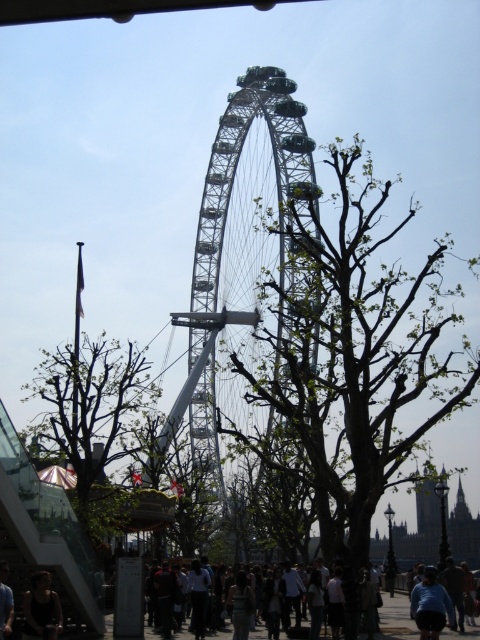
Between green metallic ferris wheel at center and dark brown hair at lower left, which one is positioned higher?

green metallic ferris wheel at center is higher up.

The image size is (480, 640). I want to click on green metallic ferris wheel at center, so click(251, 193).

You are a GUI agent. You are given a task and a screenshot of the screen. Output one action in this format:
    pyautogui.click(x=<x>, y=<y>)
    Task: Click on the green metallic ferris wheel at center
    
    Given the screenshot: What is the action you would take?
    pyautogui.click(x=251, y=193)

In the scene shown: Which is above, green leafy tree at center or blue denim jeans at lower right?

green leafy tree at center is higher up.

Is point (372, 348) positioned after point (419, 593)?

No, (372, 348) is closer to viewer.

Between point (292, 340) and point (450, 604), which one is positioned in front?

Point (450, 604) is in front.

Where is `green leafy tree at center`? The image size is (480, 640). green leafy tree at center is located at coordinates (358, 356).

Which of these two, green metallic ferris wheel at center or green leafy tree at left, stands shorter?

green leafy tree at left

Is green metallic ferris wheel at center shorter than green leafy tree at left?

No.

What do you see at coordinates (251, 193) in the screenshot? The image size is (480, 640). I see `green metallic ferris wheel at center` at bounding box center [251, 193].

Identify the location of green metallic ferris wheel at center. Image resolution: width=480 pixels, height=640 pixels. (251, 193).